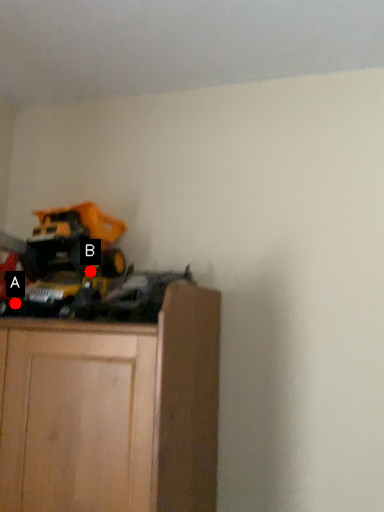
Question: Two points are circled on the image, labeled by A and B beside each circle. Which point is closer to the camera?

Choices:
 (A) A is closer
 (B) B is closer

Answer: (A)